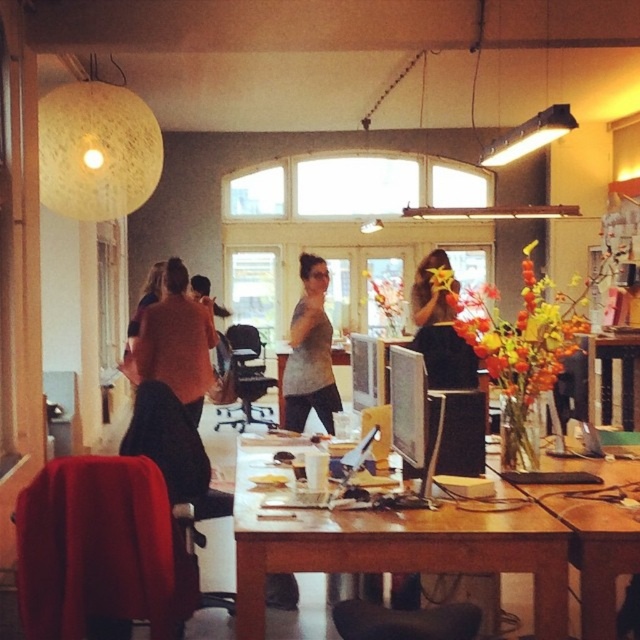
Does matte gray sweater at center appear on the left side of black dress at center?

Correct, you'll find matte gray sweater at center to the left of black dress at center.

Can you confirm if matte gray sweater at center is positioned below black dress at center?

Yes.

Who is more forward, [304,340] or [449,314]?

Positioned in front is point [449,314].

Find the location of a particular element. matte gray sweater at center is located at coordinates (308, 353).

The height and width of the screenshot is (640, 640). Describe the element at coordinates (397, 547) in the screenshot. I see `wooden desk at center` at that location.

Is wooden desk at center taller than wooden table at center?

Indeed, wooden desk at center has a greater height compared to wooden table at center.

Who is more distant from viewer, (244, 500) or (592, 552)?

Point (244, 500)

Where is `wooden desk at center`? wooden desk at center is located at coordinates (397, 547).

Which is more to the right, wooden desk at center or matte gray sweater at center?

Positioned to the right is wooden desk at center.

Can you confirm if wooden desk at center is thinner than matte gray sweater at center?

In fact, wooden desk at center might be wider than matte gray sweater at center.

Is point (563, 595) positioned before point (326, 352)?

Yes, it is.

You are a GUI agent. You are given a task and a screenshot of the screen. Output one action in this format:
    pyautogui.click(x=<x>, y=<y>)
    Task: Click on the wooden desk at center
    Image resolution: width=640 pixels, height=640 pixels.
    Given the screenshot: What is the action you would take?
    pyautogui.click(x=397, y=547)